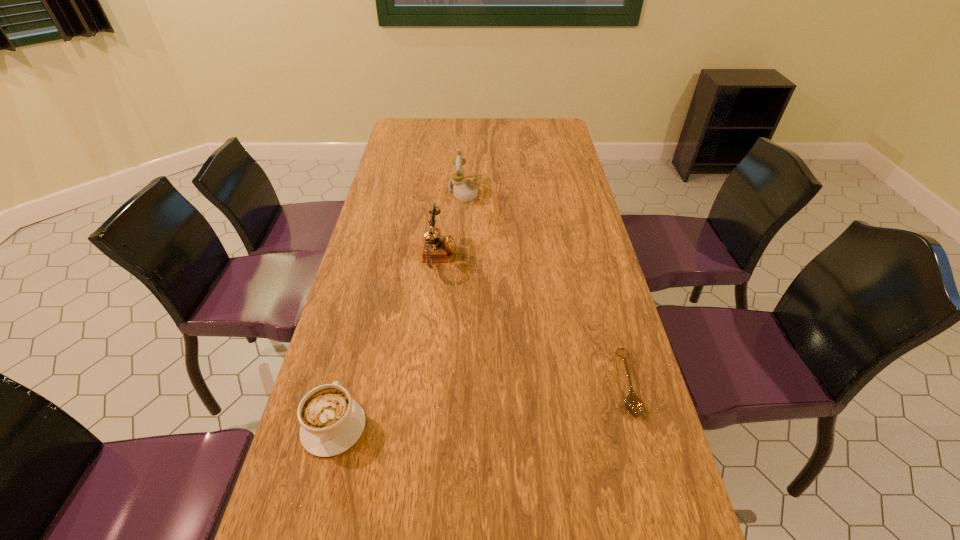
Find the location of a particular element. The height and width of the screenshot is (540, 960). the third nearest object is located at coordinates (436, 248).

This screenshot has width=960, height=540. Find the location of `the farther telephone`. the farther telephone is located at coordinates (465, 190).

This screenshot has width=960, height=540. In order to click on the second shortest object in this screenshot , I will do `click(331, 422)`.

Where is `cappuccino`? This screenshot has width=960, height=540. cappuccino is located at coordinates (331, 422).

This screenshot has height=540, width=960. What are the coordinates of `the shortest object` in the screenshot? It's located at pos(633,404).

This screenshot has width=960, height=540. Find the location of `ladle`. ladle is located at coordinates (633, 404).

Where is `vacant space situated 0.380m on the dial number of the nearer telephone`? vacant space situated 0.380m on the dial number of the nearer telephone is located at coordinates (583, 258).

Find the location of a particular element. The height and width of the screenshot is (540, 960). free space located 0.200m on the dial of the farthest object is located at coordinates (534, 191).

Find the location of a particular element. The width and height of the screenshot is (960, 540). free spot located 0.340m to the right of the second shortest object's handle is located at coordinates (369, 288).

In order to click on free location located to the right of the second shortest object's handle in this screenshot , I will do `click(361, 318)`.